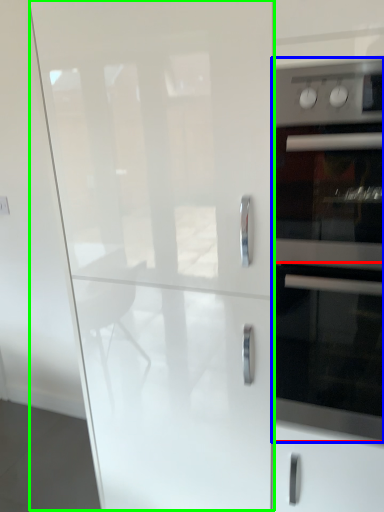
Question: Which object is positioned closest to oven (highlighted by a red box)? Select from home appliance (highlighted by a blue box) and glass door (highlighted by a green box).

Choices:
 (A) home appliance
 (B) glass door

Answer: (A)